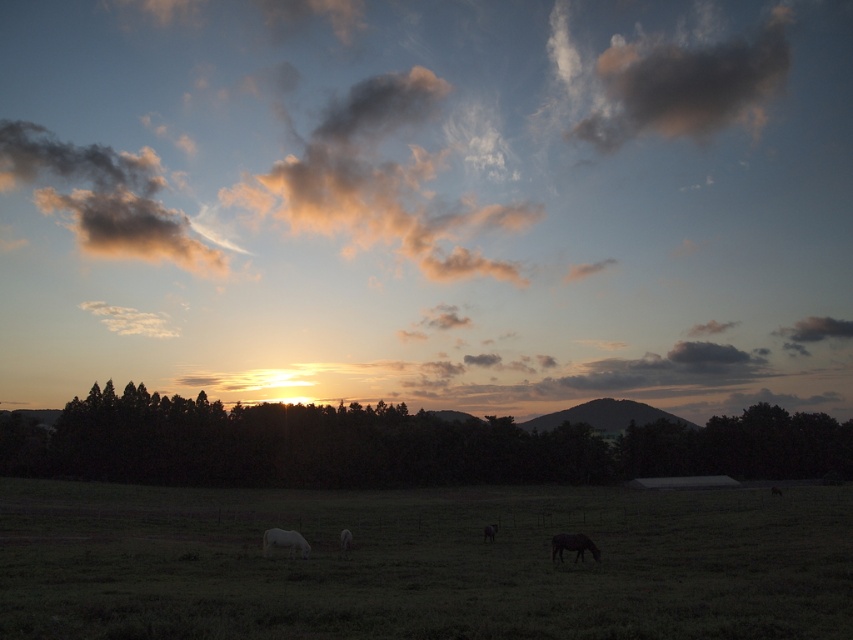
Can you confirm if matte orange cloud at upper center is smaller than dark brown horse at lower right?

Incorrect, matte orange cloud at upper center is not smaller in size than dark brown horse at lower right.

Who is more distant from viewer, (416, 177) or (560, 540)?

The point (416, 177) is behind.

Locate an element on the screen. matte orange cloud at upper center is located at coordinates (381, 182).

Does point (332, 198) come farther from viewer compared to point (3, 184)?

No, it is in front of (3, 184).

Does matte orange cloud at upper center come behind dark gray fluffy cloud at upper left?

That is False.

Which is in front, point (357, 124) or point (36, 150)?

Point (357, 124) is in front.

Identify the location of matte orange cloud at upper center. The image size is (853, 640). (381, 182).

Which is below, green grass pasture at center or dark brown horse at lower right?

green grass pasture at center

Does green grass pasture at center have a lesser width compared to dark brown horse at lower right?

In fact, green grass pasture at center might be wider than dark brown horse at lower right.

Between point (637, 500) and point (573, 536), which one is positioned behind?

The point (637, 500) is more distant.

Locate an element on the screen. The image size is (853, 640). green grass pasture at center is located at coordinates (422, 563).